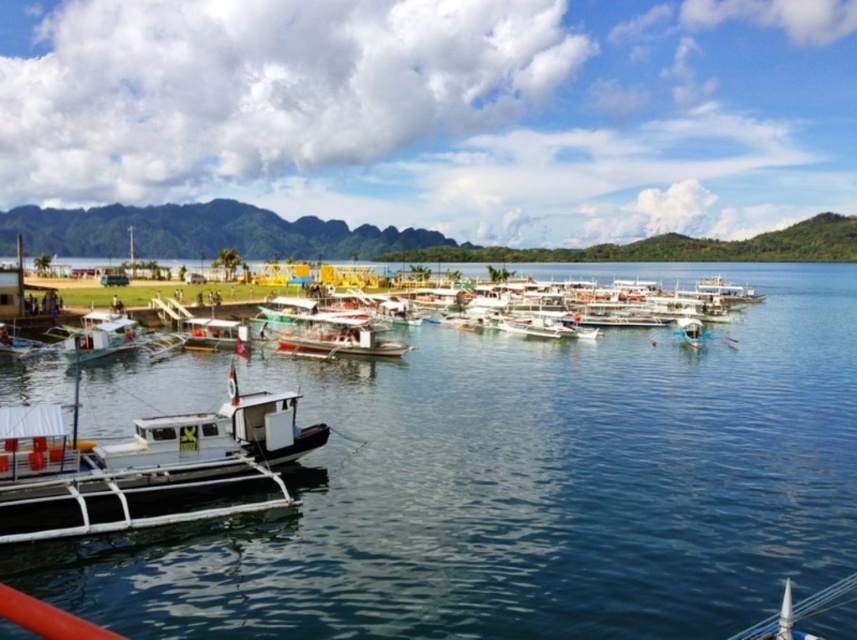
Question: In this image, where is white wooden boat at center located relative to white matte boat at left?

Choices:
 (A) left
 (B) right

Answer: (B)

Question: Based on their relative distances, which object is farther from the clear blue water at center?

Choices:
 (A) white matte boat at lower left
 (B) white matte boat at left

Answer: (B)

Question: Which point appears closest to the camera in this image?

Choices:
 (A) (87, 330)
 (B) (301, 323)
 (C) (750, 544)
 (D) (42, 512)

Answer: (D)

Question: Which point appears closest to the camera in this image?

Choices:
 (A) click(x=243, y=637)
 (B) click(x=121, y=321)
 (C) click(x=268, y=464)
 (D) click(x=391, y=346)

Answer: (A)

Question: Does clear blue water at center have a larger size compared to white wooden boat at center?

Choices:
 (A) yes
 (B) no

Answer: (A)

Question: Is white matte boat at lower left bigger than white matte boat at left?

Choices:
 (A) yes
 (B) no

Answer: (A)